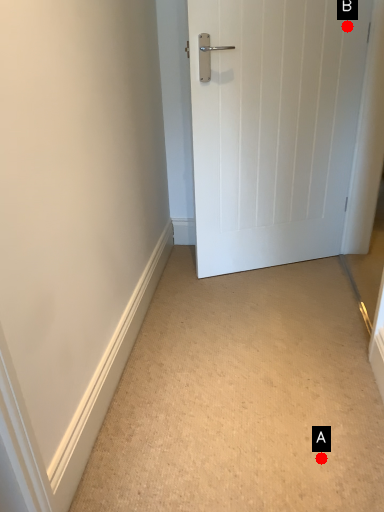
Question: Two points are circled on the image, labeled by A and B beside each circle. Which point appears closest to the camera in this image?

Choices:
 (A) A is closer
 (B) B is closer

Answer: (A)